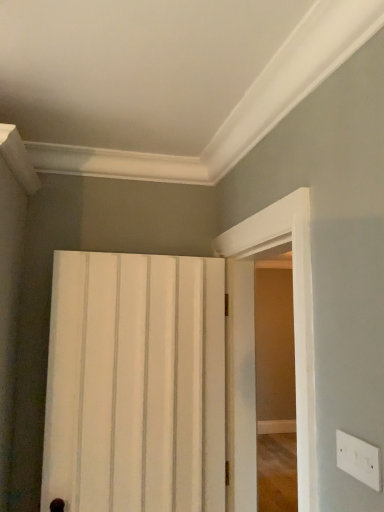
Question: Considering the relative sizes of white matte door at center and white plastic electric outlet at lower right in the image provided, is white matte door at center bigger than white plastic electric outlet at lower right?

Choices:
 (A) no
 (B) yes

Answer: (B)

Question: Can you see white matte door at center touching white plastic electric outlet at lower right?

Choices:
 (A) yes
 (B) no

Answer: (B)

Question: Is white matte door at center at the left side of white plastic electric outlet at lower right?

Choices:
 (A) no
 (B) yes

Answer: (B)

Question: From the image's perspective, is white matte door at center over white plastic electric outlet at lower right?

Choices:
 (A) yes
 (B) no

Answer: (B)

Question: Considering the relative positions of white matte door at center and white plastic electric outlet at lower right in the image provided, is white matte door at center behind white plastic electric outlet at lower right?

Choices:
 (A) yes
 (B) no

Answer: (A)

Question: Can you confirm if white matte door at center is smaller than white plastic electric outlet at lower right?

Choices:
 (A) yes
 (B) no

Answer: (B)

Question: Is white glossy door at right inside white matte door at center?

Choices:
 (A) yes
 (B) no

Answer: (B)

Question: Is white matte door at center thinner than white glossy door at right?

Choices:
 (A) yes
 (B) no

Answer: (A)

Question: From the image's perspective, is white matte door at center above white glossy door at right?

Choices:
 (A) no
 (B) yes

Answer: (A)

Question: Is white matte door at center taller than white glossy door at right?

Choices:
 (A) no
 (B) yes

Answer: (A)

Question: Is white matte door at center outside of white glossy door at right?

Choices:
 (A) yes
 (B) no

Answer: (A)

Question: From a real-world perspective, is white matte door at center physically above white glossy door at right?

Choices:
 (A) no
 (B) yes

Answer: (A)

Question: Is white plastic electric outlet at lower right wider than white glossy door at right?

Choices:
 (A) yes
 (B) no

Answer: (B)